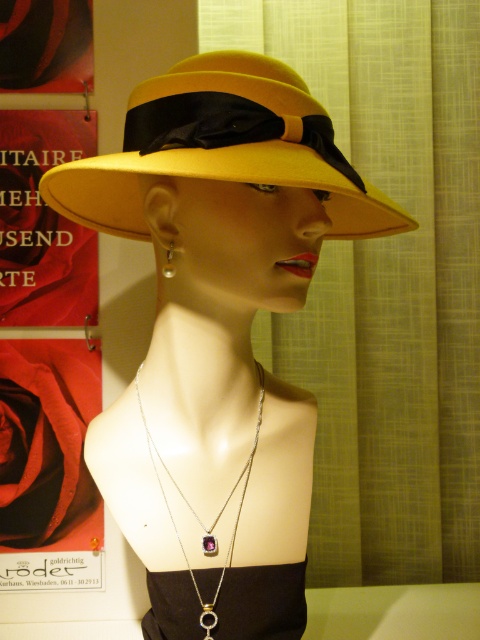
Question: Does matte yellow hat at center appear under silver metallic earring at upper left?

Choices:
 (A) yes
 (B) no

Answer: (A)

Question: Does matte yellow hat at center come behind black satin dress at center?

Choices:
 (A) no
 (B) yes

Answer: (A)

Question: Which is farther from the matte yellow hat at center?

Choices:
 (A) silver/golden chain necklace with gemstone pendant at center
 (B) red matte poster at upper left
 (C) black satin dress at center

Answer: (B)

Question: Which point is farther to the camera?

Choices:
 (A) (213, 596)
 (B) (254, 611)
 (C) (143, 118)

Answer: (B)

Question: Does red matte poster at upper left appear on the left side of silver metallic earring at upper left?

Choices:
 (A) yes
 (B) no

Answer: (A)

Question: Which point is farther to the camera?

Choices:
 (A) (101, 524)
 (B) (135, 448)
 (C) (251, 125)
 (D) (166, 269)

Answer: (A)